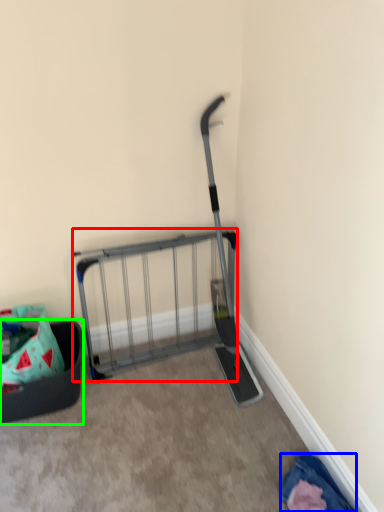
Question: Which object is the closest to the cart (highlighted by a red box)? Choose among these: clothing (highlighted by a blue box) or furniture (highlighted by a green box).

Choices:
 (A) clothing
 (B) furniture

Answer: (B)